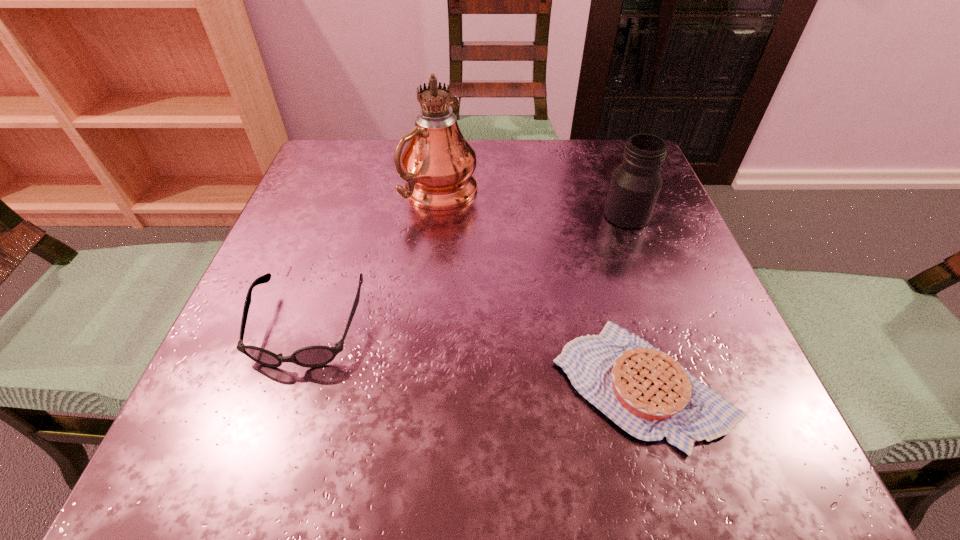
Identify the location of oil lamp. (438, 163).

What are the coordinates of `the tallest object` in the screenshot? It's located at (438, 163).

At what (x,y) coordinates should I click in order to perform the action: click on jar. Please return your answer as a coordinate pair (x, y). The width and height of the screenshot is (960, 540). Looking at the image, I should click on (636, 183).

I want to click on sunglasses, so click(312, 356).

Image resolution: width=960 pixels, height=540 pixels. I want to click on the third tallest object, so click(x=312, y=356).

Image resolution: width=960 pixels, height=540 pixels. Identify the location of the shortest object. (647, 393).

Where is `free space located 0.150m on the right of the oil lamp`? The width and height of the screenshot is (960, 540). free space located 0.150m on the right of the oil lamp is located at coordinates (550, 192).

Find the location of `vacant space located 0.200m on the back of the jar`. vacant space located 0.200m on the back of the jar is located at coordinates (603, 150).

This screenshot has width=960, height=540. Identify the location of vacant space located on the lenses of the leftmost object. (268, 443).

The width and height of the screenshot is (960, 540). I want to click on vacant area situated on the left of the pie, so click(x=475, y=383).